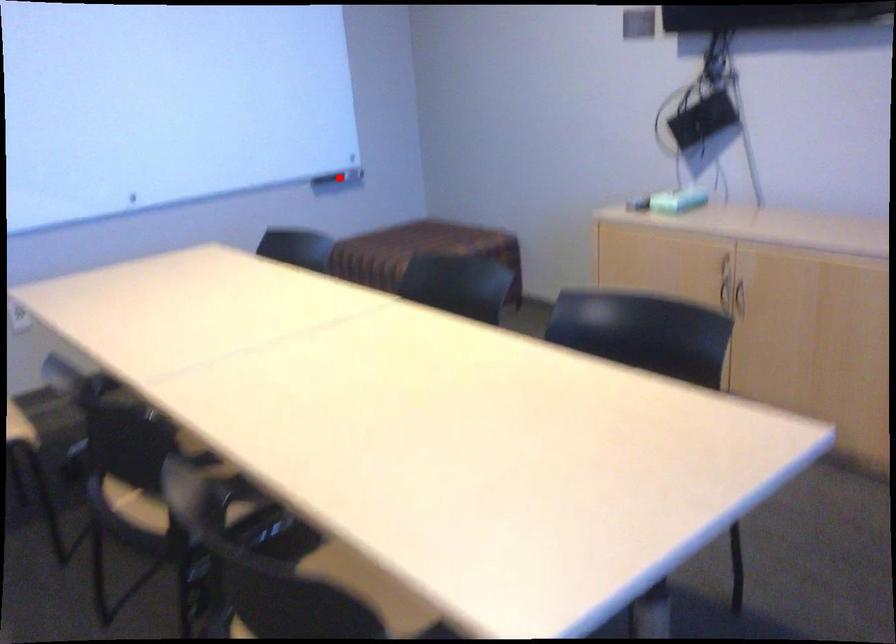
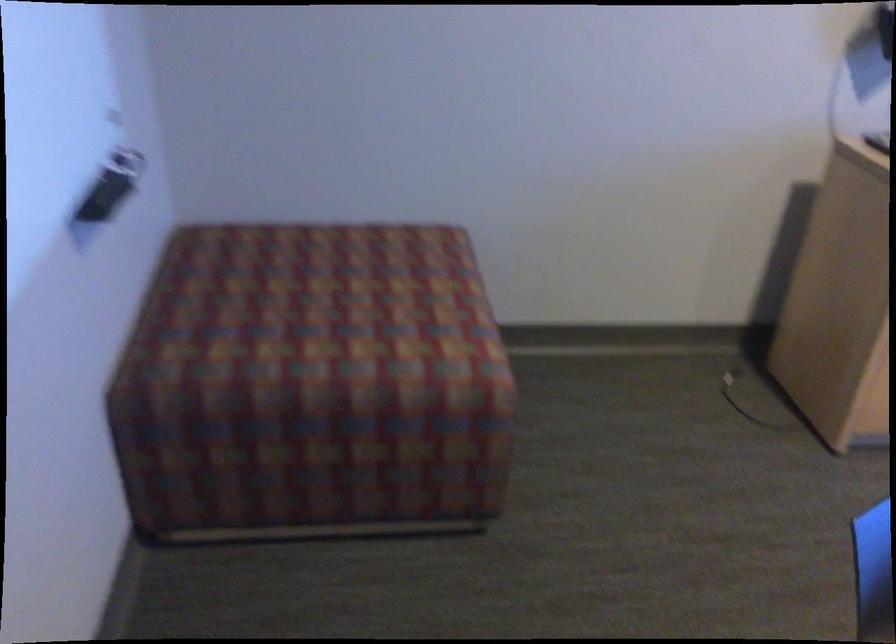
Question: I am providing you with two images of the same scene from different viewpoints. A red point is marked on the first image. At the location where the point appears in image 1, is it still visible in image 2?

Choices:
 (A) Yes
 (B) No

Answer: (B)